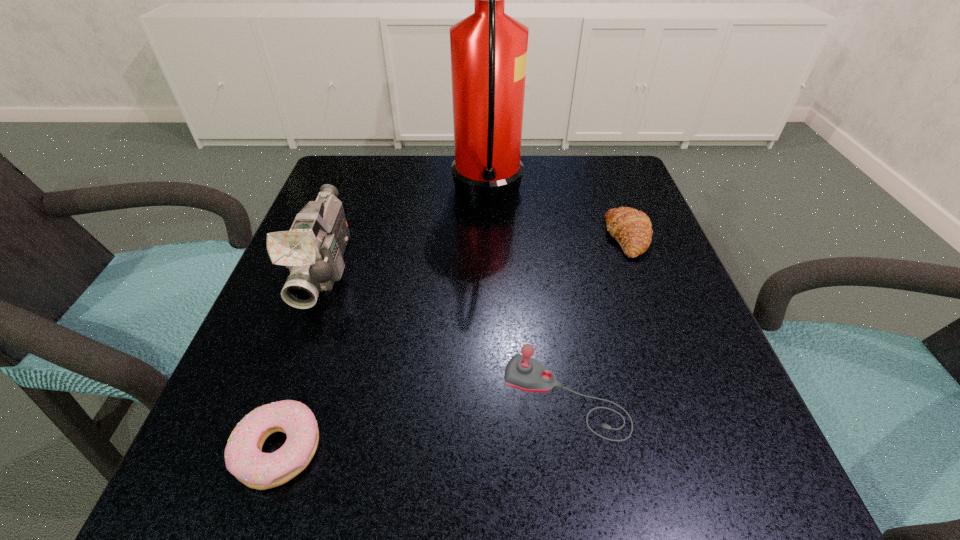
Locate an element on the screen. This screenshot has height=540, width=960. free space located on the back of the joystick is located at coordinates (542, 249).

The height and width of the screenshot is (540, 960). Identify the location of vacant space situated 0.200m on the back of the fourth tallest object. (601, 168).

Find the location of `vacant area situated on the back of the doughnut`. vacant area situated on the back of the doughnut is located at coordinates (311, 352).

At what (x,y) coordinates should I click in order to perform the action: click on object at the far edge. Please return your answer as a coordinate pair (x, y). This screenshot has width=960, height=540. Looking at the image, I should click on (488, 49).

The height and width of the screenshot is (540, 960). Find the location of `object situated at the near edge`. object situated at the near edge is located at coordinates (244, 459).

Find the location of a particular element. This screenshot has height=540, width=960. camcorder that is at the left edge is located at coordinates (313, 249).

The height and width of the screenshot is (540, 960). What are the coordinates of `doughnut that is at the left edge` in the screenshot? It's located at (244, 459).

Where is `joystick present at the right edge`? This screenshot has height=540, width=960. joystick present at the right edge is located at coordinates (522, 372).

Locate an element on the screen. crescent roll located at the right edge is located at coordinates (631, 228).

Where is `object that is at the near left corner`? object that is at the near left corner is located at coordinates (244, 459).